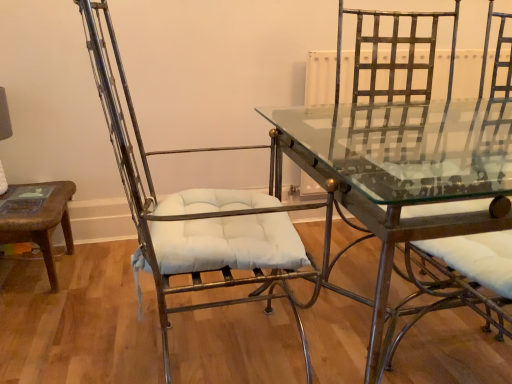
Find the location of a particular element. The height and width of the screenshot is (384, 512). metallic wire chair at left is located at coordinates (201, 213).

Describe the element at coordinates (456, 282) in the screenshot. I see `metallic gold swivel chair at right` at that location.

Where is `clear glass table at center`? The image size is (512, 384). clear glass table at center is located at coordinates (404, 171).

Is metallic gold swivel chair at right spatially inside metallic wire chair at left, or outside of it?

The correct answer is: outside.

Is metallic gold swivel chair at right not close to metallic wire chair at left?

metallic gold swivel chair at right is actually quite close to metallic wire chair at left.

From a real-world perspective, between metallic gold swivel chair at right and metallic wire chair at left, who is vertically lower?

metallic gold swivel chair at right is physically lower.

From the image's perspective, who appears lower, clear glass table at center or metallic gold swivel chair at right?

From the image's view, clear glass table at center is below.

Can you confirm if clear glass table at center is shorter than metallic gold swivel chair at right?

Yes.

Which of these two, clear glass table at center or metallic gold swivel chair at right, is bigger?

Bigger between the two is clear glass table at center.

How far apart are clear glass table at center and metallic gold swivel chair at right?

A distance of 24.28 inches exists between clear glass table at center and metallic gold swivel chair at right.

Which is farther, (x=505, y=258) or (x=434, y=103)?

The point (x=434, y=103) is farther.

Between metallic gold swivel chair at right and clear glass table at center, which one appears on the left side from the viewer's perspective?

Positioned to the left is clear glass table at center.

Looking at this image, is metallic gold swivel chair at right positioned far away from clear glass table at center?

metallic gold swivel chair at right is near clear glass table at center, not far away.

Looking at their sizes, would you say clear glass table at center is wider or thinner than metallic wire chair at left?

Clearly, clear glass table at center has more width compared to metallic wire chair at left.

Which object is further away from the camera, clear glass table at center or metallic wire chair at left?

metallic wire chair at left is further away from the camera.

Would you say clear glass table at center is outside metallic wire chair at left?

That's correct, clear glass table at center is outside of metallic wire chair at left.

From a real-world perspective, between metallic wire chair at left and clear glass table at center, who is vertically higher?

metallic wire chair at left.

Considering the sizes of objects metallic wire chair at left and clear glass table at center in the image provided, who is shorter, metallic wire chair at left or clear glass table at center?

clear glass table at center is shorter.

What's the angular difference between metallic wire chair at left and clear glass table at center's facing directions?

The angular difference between metallic wire chair at left and clear glass table at center is 4.74 degrees.

Is metallic wire chair at left oriented towards clear glass table at center?

No.

What's the angular difference between metallic wire chair at left and metallic gold swivel chair at right's facing directions?

They differ by 6.52 degrees in their facing directions.

Can you confirm if metallic wire chair at left is shorter than metallic gold swivel chair at right?

No.

Consider the image. From a real-world perspective, which object stands above the other?

metallic wire chair at left is physically above.

Would you say metallic wire chair at left is a long distance from metallic gold swivel chair at right?

That's not correct — metallic wire chair at left is a little close to metallic gold swivel chair at right.

At what (x,y) coordinates should I click in order to perform the action: click on chair that appears above the metallic gold swivel chair at right (from the image's perspective). Please return your answer as a coordinate pair (x, y). Looking at the image, I should click on (201, 213).

The image size is (512, 384). In order to click on table below the metallic gold swivel chair at right (from a real-world perspective) in this screenshot , I will do `click(404, 171)`.

Estimate the real-world distances between objects in this image. Which object is further from metallic gold swivel chair at right, clear glass table at center or metallic wire chair at left?

Based on the image, clear glass table at center appears to be further to metallic gold swivel chair at right.

Considering their positions, is metallic gold swivel chair at right positioned closer to metallic wire chair at left than clear glass table at center?

The object closer to metallic wire chair at left is clear glass table at center.

Which object lies nearer to the anchor point clear glass table at center, metallic gold swivel chair at right or metallic wire chair at left?

metallic wire chair at left lies closer to clear glass table at center than the other object.

Based on their spatial positions, is metallic wire chair at left or clear glass table at center closer to metallic gold swivel chair at right?

metallic wire chair at left is positioned closer to the anchor metallic gold swivel chair at right.

Which object lies nearer to the anchor point clear glass table at center, metallic wire chair at left or metallic gold swivel chair at right?

Based on the image, metallic wire chair at left appears to be nearer to clear glass table at center.

Based on their spatial positions, is clear glass table at center or metallic gold swivel chair at right closer to metallic wire chair at left?

clear glass table at center is positioned closer to the anchor metallic wire chair at left.

Identify the location of table between metallic wire chair at left and metallic gold swivel chair at right in the horizontal direction. The image size is (512, 384). (404, 171).